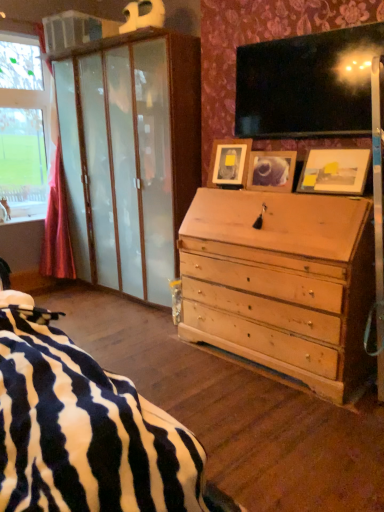
Question: Considering the relative positions of wooden photo frame at upper right, marked as the 3th picture frame in a left-to-right arrangement, and wooden picture frame at center, positioned as the 2th picture frame in left-to-right order, in the image provided, is wooden photo frame at upper right, marked as the 3th picture frame in a left-to-right arrangement, to the right of wooden picture frame at center, positioned as the 2th picture frame in left-to-right order, from the viewer's perspective?

Choices:
 (A) yes
 (B) no

Answer: (A)

Question: Can you confirm if wooden photo frame at upper right, marked as the 3th picture frame in a left-to-right arrangement, is taller than wooden picture frame at center, acting as the second picture frame starting from the right?

Choices:
 (A) no
 (B) yes

Answer: (B)

Question: From a real-world perspective, is wooden photo frame at upper right, positioned as the first picture frame in right-to-left order, located beneath wooden picture frame at center, positioned as the 2th picture frame in left-to-right order?

Choices:
 (A) no
 (B) yes

Answer: (A)

Question: From the image's perspective, is wooden photo frame at upper right, positioned as the first picture frame in right-to-left order, on top of wooden picture frame at center, acting as the second picture frame starting from the right?

Choices:
 (A) yes
 (B) no

Answer: (B)

Question: Would you consider wooden photo frame at upper right, positioned as the first picture frame in right-to-left order, to be distant from wooden picture frame at center, acting as the second picture frame starting from the right?

Choices:
 (A) no
 (B) yes

Answer: (A)

Question: Does point (231, 147) appear closer or farther from the camera than point (324, 152)?

Choices:
 (A) farther
 (B) closer

Answer: (A)

Question: In terms of height, does wooden picture frame at center, which ranks as the third picture frame in right-to-left order, look taller or shorter compared to wooden photo frame at upper right, positioned as the first picture frame in right-to-left order?

Choices:
 (A) tall
 (B) short

Answer: (A)

Question: From a real-world perspective, is wooden picture frame at center, the 1th picture frame positioned from the left, positioned above or below wooden photo frame at upper right, marked as the 3th picture frame in a left-to-right arrangement?

Choices:
 (A) above
 (B) below

Answer: (A)

Question: Is wooden picture frame at center, which ranks as the third picture frame in right-to-left order, inside or outside of wooden photo frame at upper right, positioned as the first picture frame in right-to-left order?

Choices:
 (A) inside
 (B) outside

Answer: (B)

Question: In terms of width, does wooden picture frame at center, the 1th picture frame positioned from the left, look wider or thinner when compared to wooden picture frame at center, positioned as the 2th picture frame in left-to-right order?

Choices:
 (A) thin
 (B) wide

Answer: (B)

Question: Is wooden picture frame at center, the 1th picture frame positioned from the left, taller or shorter than wooden picture frame at center, positioned as the 2th picture frame in left-to-right order?

Choices:
 (A) short
 (B) tall

Answer: (B)

Question: Relative to wooden picture frame at center, acting as the second picture frame starting from the right, is wooden picture frame at center, the 1th picture frame positioned from the left, in front or behind?

Choices:
 (A) behind
 (B) front

Answer: (A)

Question: Is point (231, 150) closer or farther from the camera than point (286, 170)?

Choices:
 (A) farther
 (B) closer

Answer: (A)

Question: In terms of width, does wooden photo frame at upper right, marked as the 3th picture frame in a left-to-right arrangement, look wider or thinner when compared to wooden picture frame at center, which ranks as the third picture frame in right-to-left order?

Choices:
 (A) wide
 (B) thin

Answer: (A)

Question: From the image's perspective, is wooden photo frame at upper right, positioned as the first picture frame in right-to-left order, positioned above or below wooden picture frame at center, the 1th picture frame positioned from the left?

Choices:
 (A) above
 (B) below

Answer: (B)